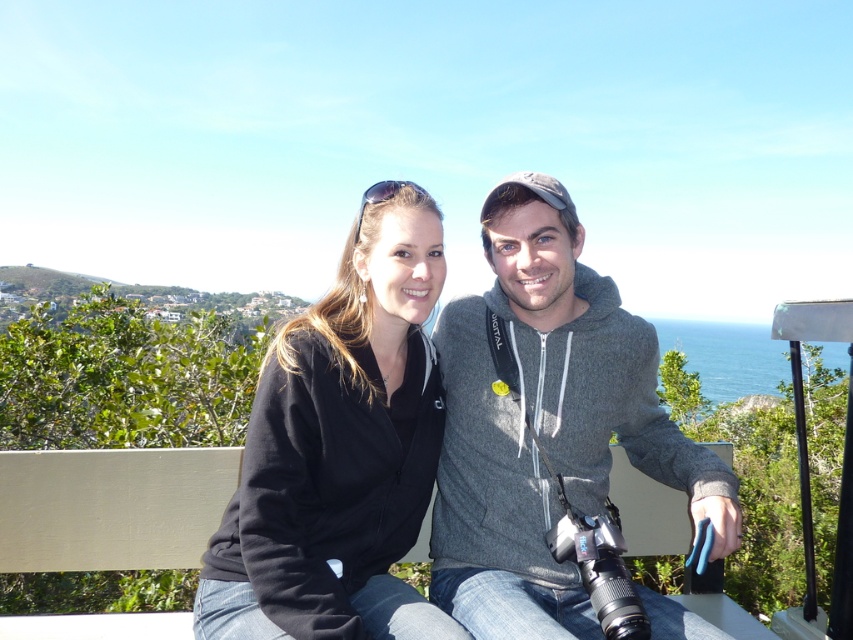
I want to click on gray fleece hoodie at center, so click(546, 422).

Looking at this image, who is lower down, gray fleece hoodie at center or black fleece jacket at center?

black fleece jacket at center is lower down.

Where is `gray fleece hoodie at center`? Image resolution: width=853 pixels, height=640 pixels. gray fleece hoodie at center is located at coordinates (546, 422).